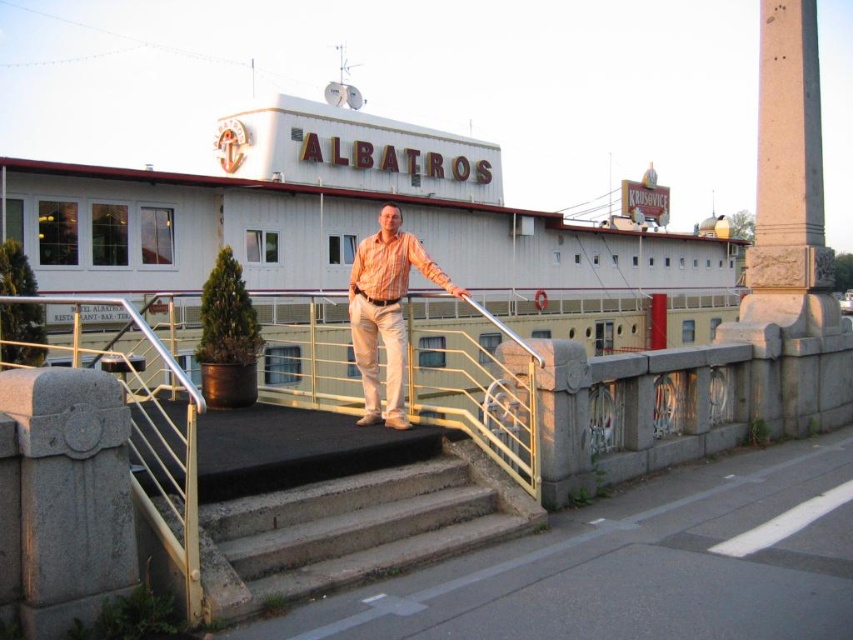
You are a delivery person trying to navigate to the ALBATROS building. You see the concrete stairs at center and the silver metallic railing at center. Which object is closer to you as you approach the building from the front?

The concrete stairs at center are closer to you because the silver metallic railing at center is behind them.

You are a photographer trying to capture a clear shot of the building named ALBATROS. However, the silver metallic railing at center and the matte orange shirt at center are blocking your view. Which object is closer to you, making it the primary obstruction?

The silver metallic railing at center is positioned under the matte orange shirt at center, meaning the matte orange shirt at center is closer to you, making it the primary obstruction.

Based on the photo, you need to walk up the stairs while carrying a wide box that is as wide as the silver metallic railing at center. Will the concrete stairs at center be wide enough for you to walk up while carrying the box?

The concrete stairs at center is thinner than the silver metallic railing at center. Since the box is as wide as the railing, the stairs are narrower than the box, so they won not be wide enough to carry the box up.